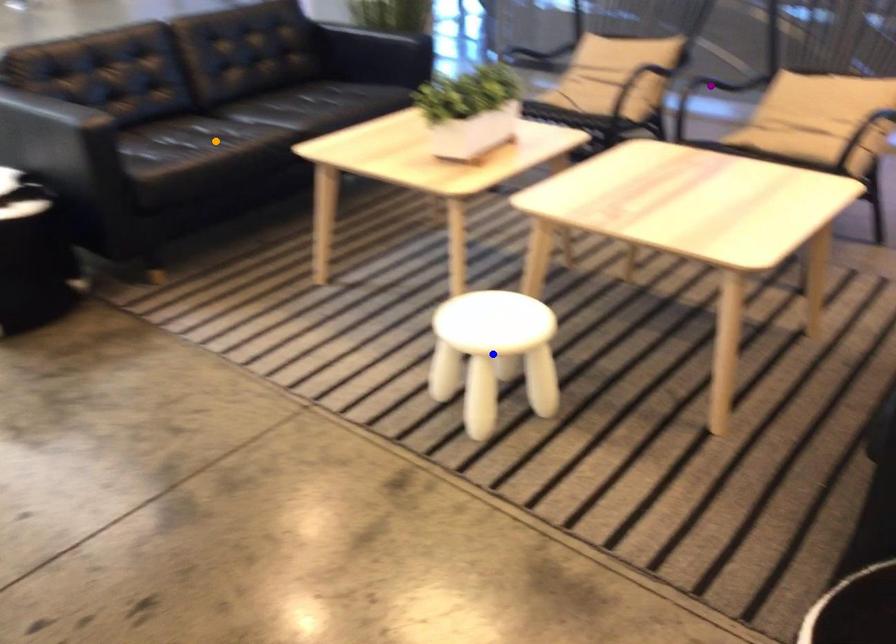
From the picture: Order these from nearest to farthest:
A) orange point
B) blue point
C) purple point

1. blue point
2. orange point
3. purple point